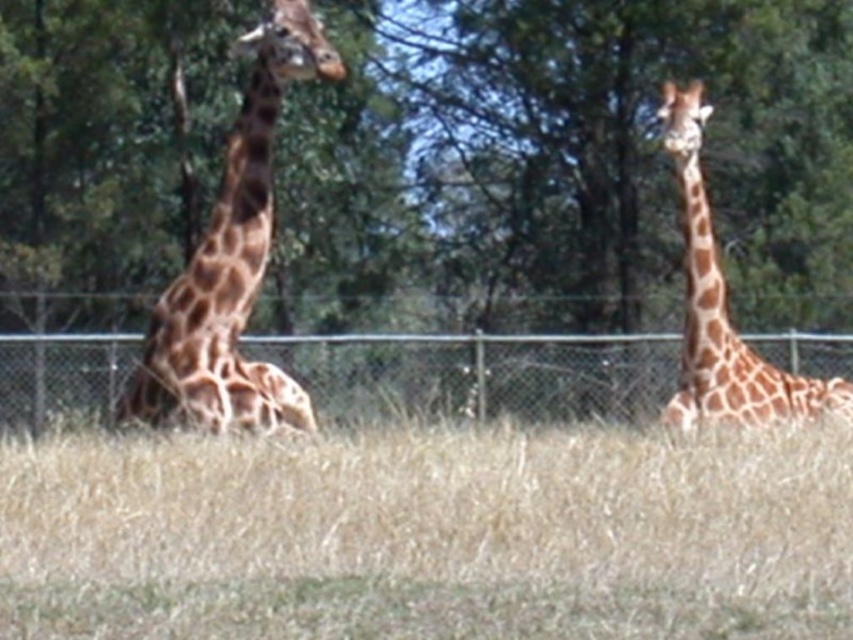
Question: Which of the following is the farthest from the observer?

Choices:
 (A) 90,408
 (B) 447,52
 (C) 737,550
 (D) 160,378

Answer: (B)

Question: Which of the following is the farthest from the observer?

Choices:
 (A) spotted brown giraffe at left
 (B) green leafy tree at center
 (C) metallic chain-link fence at center
 (D) brown spotted giraffe at right

Answer: (B)

Question: Which of the following is the farthest from the observer?

Choices:
 (A) (73, 352)
 (B) (247, 200)
 (C) (682, 456)

Answer: (A)

Question: Where is green leafy tree at center located in relation to spotted brown giraffe at left in the image?

Choices:
 (A) above
 (B) below

Answer: (A)

Question: From the image, what is the correct spatial relationship of green leafy tree at center in relation to dry grass at lower center?

Choices:
 (A) above
 (B) below

Answer: (A)

Question: Can you confirm if metallic chain-link fence at center is positioned below brown spotted giraffe at right?

Choices:
 (A) no
 (B) yes

Answer: (B)